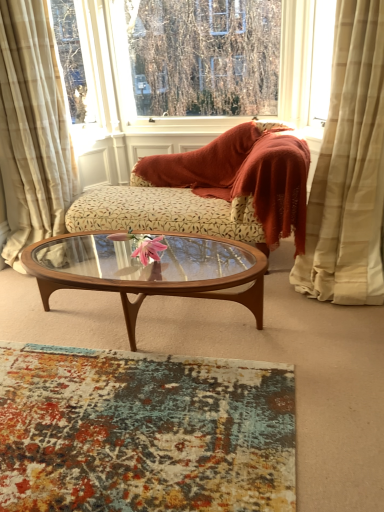
Question: Is floral-patterned fabric couch at center to the left or to the right of wooden glass coffee table at center in the image?

Choices:
 (A) left
 (B) right

Answer: (B)

Question: Is floral-patterned fabric couch at center inside the boundaries of wooden glass coffee table at center, or outside?

Choices:
 (A) outside
 (B) inside

Answer: (A)

Question: Which of these objects is positioned closest to the wooden glass coffee table at center?

Choices:
 (A) beige plaid curtain at left, the 1th curtain positioned from the left
 (B) transparent glass window at upper center
 (C) beige textured curtain at right, which is the 1th curtain in right-to-left order
 (D) floral-patterned fabric couch at center

Answer: (D)

Question: Based on their relative distances, which object is farther from the transparent glass window at upper center?

Choices:
 (A) wooden glass coffee table at center
 (B) floral-patterned fabric couch at center
 (C) beige textured curtain at right, which is the 1th curtain in right-to-left order
 (D) beige plaid curtain at left, the second curtain viewed from the right

Answer: (A)